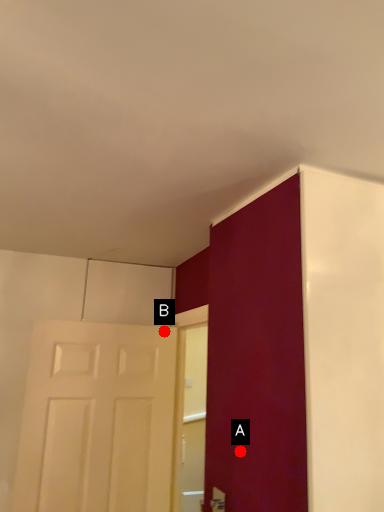
Question: Two points are circled on the image, labeled by A and B beside each circle. Among these points, which one is farthest from the camera?

Choices:
 (A) A is further
 (B) B is further

Answer: (B)